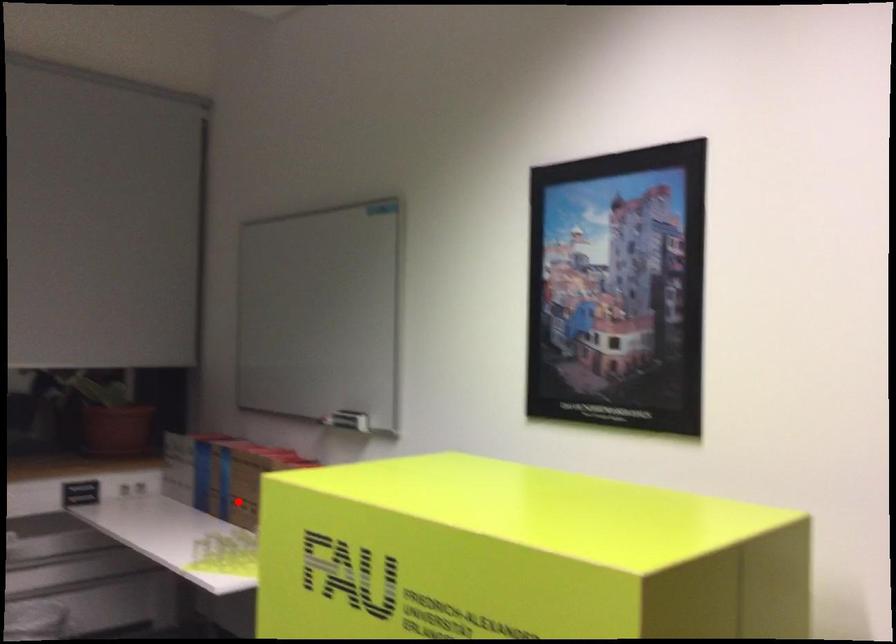
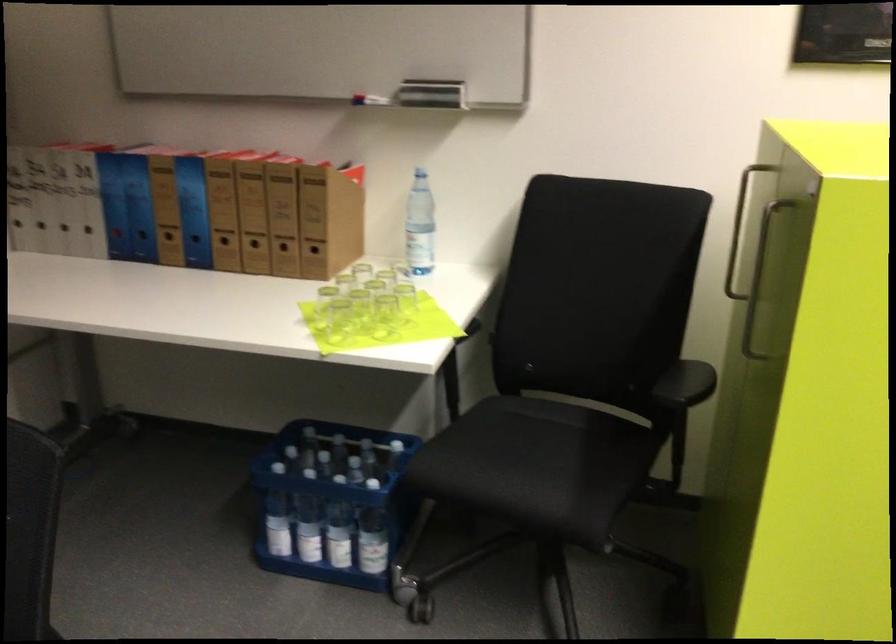
Where in the second image is the point corresponding to the highlighted location from the first image?

(225, 245)